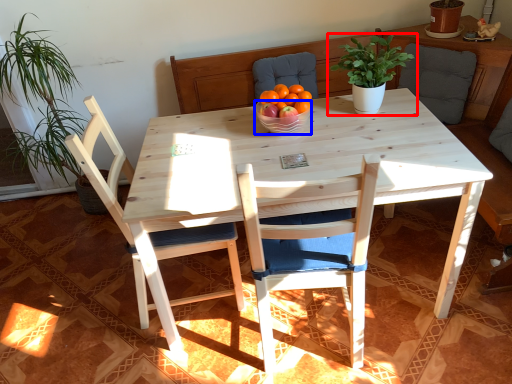
Question: Among these objects, which one is nearest to the camera, houseplant (highlighted by a red box) or bowl (highlighted by a blue box)?

Choices:
 (A) houseplant
 (B) bowl

Answer: (A)